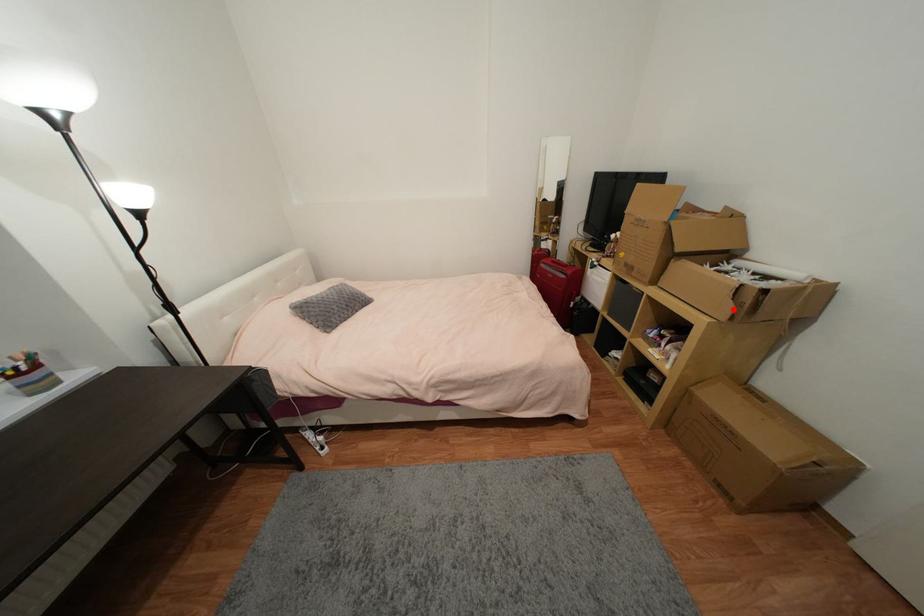
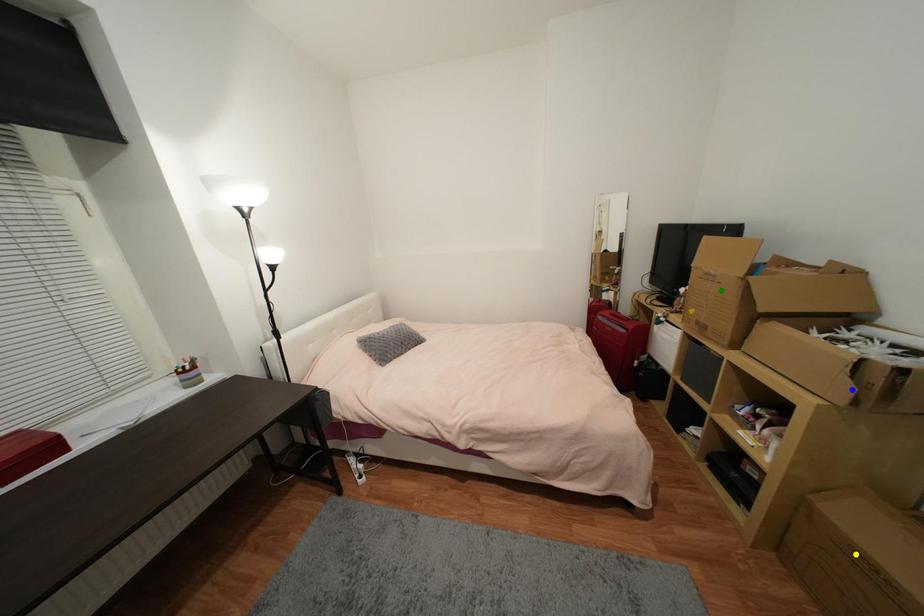
Question: I am providing you with two images of the same scene from different viewpoints. A red point is marked on the first image. You are given multiple points on the second image. Which point in image 2 represents the same 3d spot as the red point in image 1?

Choices:
 (A) blue point
 (B) yellow point
 (C) green point

Answer: (A)